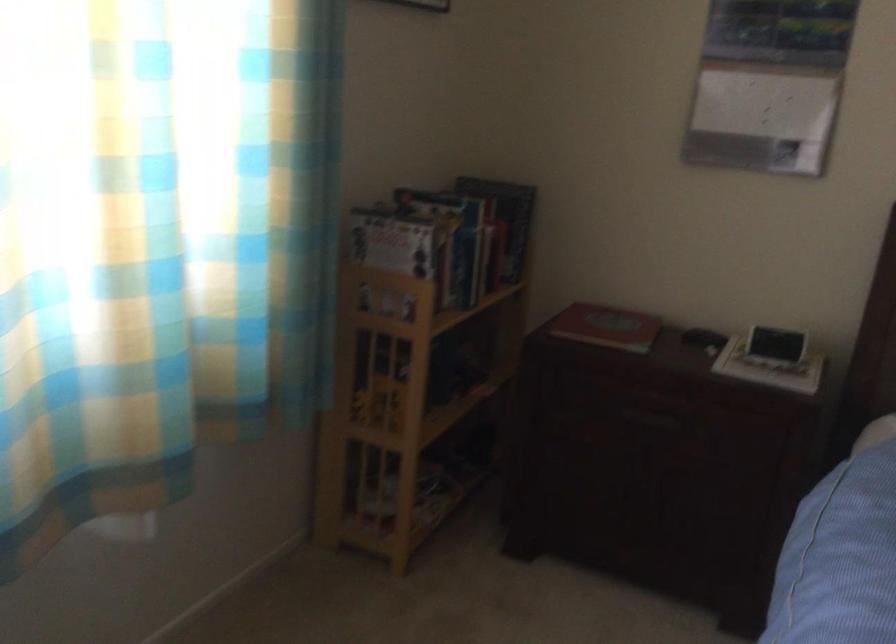
Which object does [776,344] point to?

This point indicates the digital alarm clock.